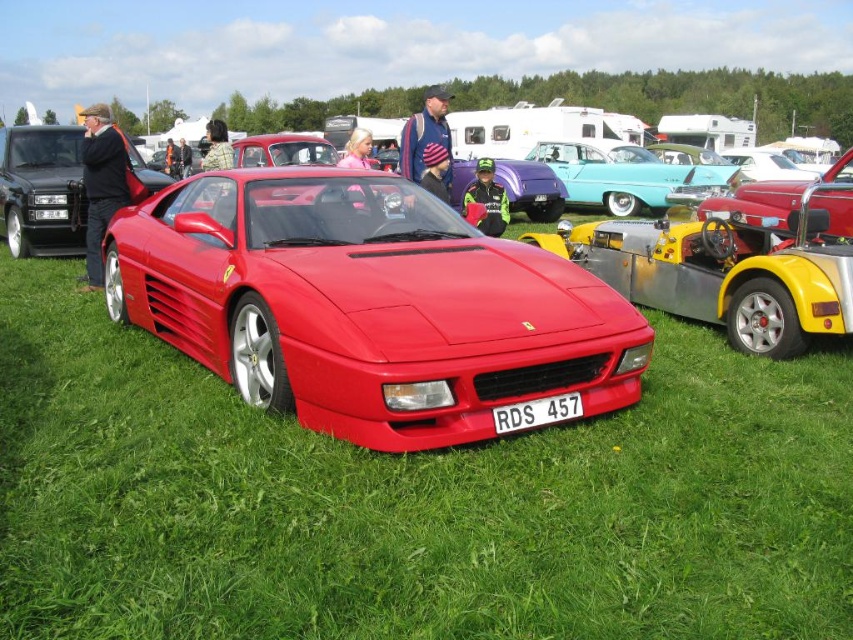
Is point (451, 161) positioned behind point (505, 404)?

Yes, point (451, 161) is behind point (505, 404).

Is glossy red car at center shorter than white plastic license plate at center?

Incorrect, glossy red car at center's height does not fall short of white plastic license plate at center's.

Between point (474, 161) and point (537, 420), which one is positioned in front?

Point (537, 420)

The width and height of the screenshot is (853, 640). I want to click on glossy red car at center, so click(531, 188).

From the picture: Is green grass at center wider than white plastic license plate at center?

Correct, the width of green grass at center exceeds that of white plastic license plate at center.

Is point (535, 488) closer to viewer compared to point (527, 413)?

Yes, it is.

Find the location of a particular element. green grass at center is located at coordinates (410, 500).

Looking at this image, is green grass at center to the left of matte red sports car at center from the viewer's perspective?

No, green grass at center is not to the left of matte red sports car at center.

Is green grass at center closer to camera compared to matte red sports car at center?

Yes, green grass at center is in front of matte red sports car at center.

Describe the element at coordinates (410, 500) in the screenshot. I see `green grass at center` at that location.

Locate an element on the screen. green grass at center is located at coordinates (410, 500).